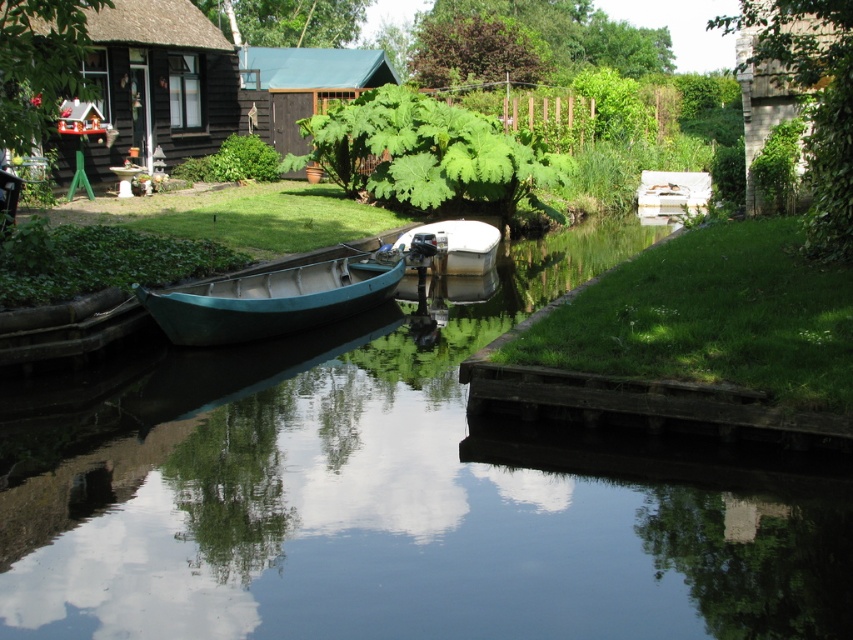
Can you confirm if green leafy tree at upper right is wider than brown wooden cabin at upper center?

Yes, green leafy tree at upper right is wider than brown wooden cabin at upper center.

Is point (836, 17) farther from camera compared to point (363, 58)?

No, (836, 17) is in front of (363, 58).

Where is `green leafy tree at upper right`? Image resolution: width=853 pixels, height=640 pixels. green leafy tree at upper right is located at coordinates (811, 100).

Is green smooth water at center taller than white matte boat at center?

Indeed, green smooth water at center has a greater height compared to white matte boat at center.

From the picture: Is green smooth water at center thinner than white matte boat at center?

No.

Which is behind, point (323, 512) or point (492, 225)?

The point (492, 225) is more distant.

I want to click on green smooth water at center, so click(390, 497).

Does green smooth water at center have a lesser width compared to teal matte canoe at center-left?

No, green smooth water at center is not thinner than teal matte canoe at center-left.

You are a GUI agent. You are given a task and a screenshot of the screen. Output one action in this format:
    pyautogui.click(x=<x>, y=<y>)
    Task: Click on the green smooth water at center
    The image size is (853, 640).
    Given the screenshot: What is the action you would take?
    pyautogui.click(x=390, y=497)

Who is more forward, (x=637, y=529) or (x=218, y=284)?

Point (x=637, y=529)

I want to click on green smooth water at center, so click(390, 497).